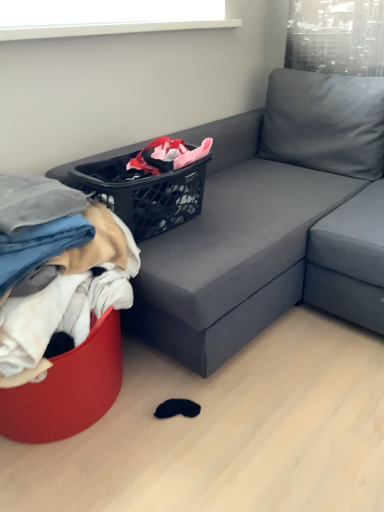
Question: Considering the positions of point (84, 318) and point (127, 187), is point (84, 318) closer or farther from the camera than point (127, 187)?

Choices:
 (A) closer
 (B) farther

Answer: (A)

Question: Is soft cotton clothes at left, arranged as the second clothing when viewed from the top, in front of or behind black plastic basket at upper center in the image?

Choices:
 (A) behind
 (B) front

Answer: (B)

Question: Based on their relative distances, which object is nearer to the denim fabric pants at lower left, the 2th clothing when ordered from bottom to top?

Choices:
 (A) black plastic basket at upper center
 (B) matte gray couch at center
 (C) soft cotton clothes at left, marked as the 1th clothing in a bottom-to-top arrangement

Answer: (C)

Question: Which is farther from the soft cotton clothes at left, marked as the 1th clothing in a bottom-to-top arrangement?

Choices:
 (A) denim fabric pants at lower left, which appears as the first clothing when viewed from the top
 (B) black plastic basket at upper center
 (C) matte gray couch at center

Answer: (C)